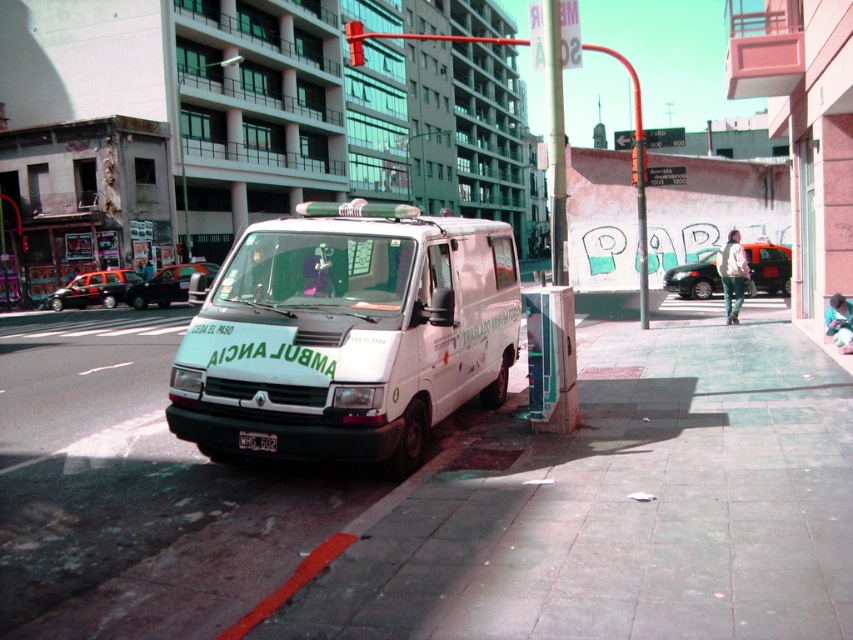
Identify the location of white concrete sidewalk at lower center. tap(440, 499).

Does white concrete sidewalk at lower center have a lesser width compared to white matte van at center?

In fact, white concrete sidewalk at lower center might be wider than white matte van at center.

Where is `white concrete sidewalk at lower center`? white concrete sidewalk at lower center is located at coordinates (440, 499).